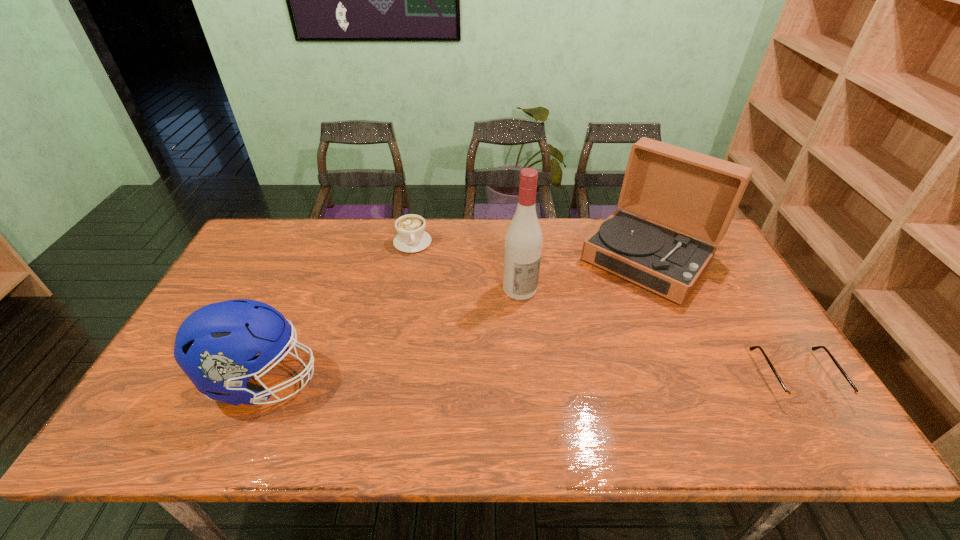
Find the location of a particular element. football helmet is located at coordinates (215, 346).

At what (x,y) coordinates should I click in order to perform the action: click on the third shortest object. Please return your answer as a coordinate pair (x, y). The height and width of the screenshot is (540, 960). Looking at the image, I should click on (215, 346).

Where is `spectacles`? spectacles is located at coordinates (791, 397).

You are a GUI agent. You are given a task and a screenshot of the screen. Output one action in this format:
    pyautogui.click(x=<x>, y=<y>)
    Task: Click on the alcohol
    The image size is (960, 540).
    Given the screenshot: What is the action you would take?
    pyautogui.click(x=523, y=240)

Identify the location of the third object from right to left. (523, 240).

At what (x,y) coordinates should I click in order to perform the action: click on the fourth object from right to left. Please return your answer as a coordinate pair (x, y). Looking at the image, I should click on (411, 237).

This screenshot has width=960, height=540. What are the coordinates of `cappuccino` in the screenshot? It's located at (411, 237).

The height and width of the screenshot is (540, 960). Find the location of `the fourth shortest object`. the fourth shortest object is located at coordinates (693, 193).

The width and height of the screenshot is (960, 540). I want to click on vacant area situated on the face guard of the third shortest object, so click(397, 380).

You are a GUI agent. You are given a task and a screenshot of the screen. Output one action in this format:
    pyautogui.click(x=<x>, y=<y>)
    Task: Click on the free spot located on the label of the third object from left to right
    This screenshot has height=540, width=960.
    Given the screenshot: What is the action you would take?
    pyautogui.click(x=584, y=376)